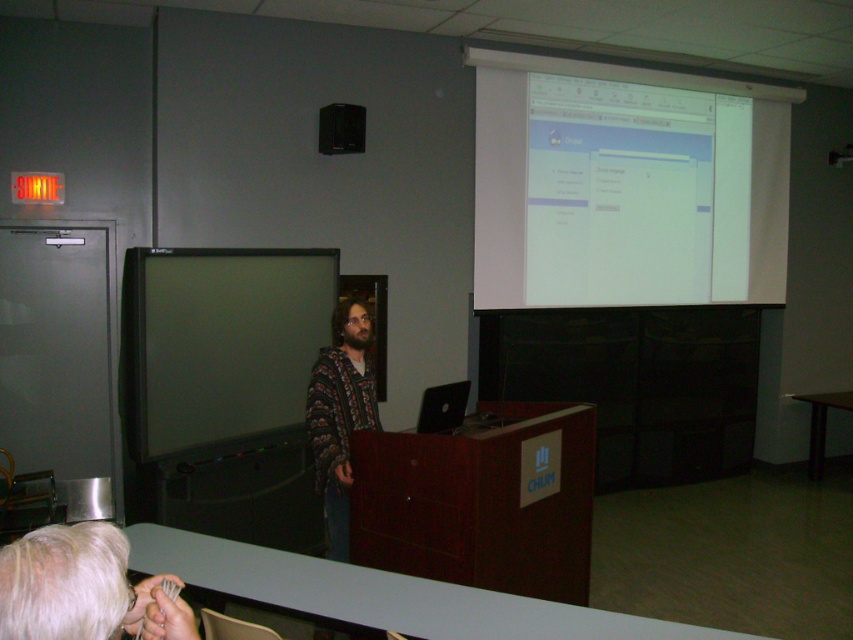
Question: Can you confirm if wooden podium at center is positioned above matte black monitor at center?

Choices:
 (A) no
 (B) yes

Answer: (A)

Question: Which is nearer to the blonde hair at lower left?

Choices:
 (A) patterned fabric shirt at center
 (B) matte black monitor at center

Answer: (A)

Question: Does patterned fabric shirt at center have a lesser width compared to black plastic speaker at upper center?

Choices:
 (A) no
 (B) yes

Answer: (A)

Question: Which object appears farthest from the camera in this image?

Choices:
 (A) black plastic speaker at upper center
 (B) wooden podium at center

Answer: (A)

Question: Which of these objects is positioned farthest from the matte black monitor at center?

Choices:
 (A) white glossy projector screen at upper right
 (B) blonde hair at lower left
 (C) wooden podium at center
 (D) black plastic speaker at upper center

Answer: (B)

Question: Does blonde hair at lower left have a larger size compared to patterned fabric shirt at center?

Choices:
 (A) yes
 (B) no

Answer: (B)